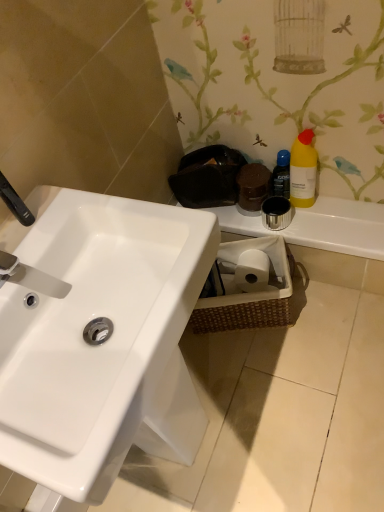
You are a GUI agent. You are given a task and a screenshot of the screen. Output one action in this format:
    pyautogui.click(x=<x>, y=<y>)
    Task: Click on the free space to the back side of matte silver faucet at left, placed as the 2th plumbing fixture when sorted from top to bottom
    
    Given the screenshot: What is the action you would take?
    pyautogui.click(x=37, y=231)